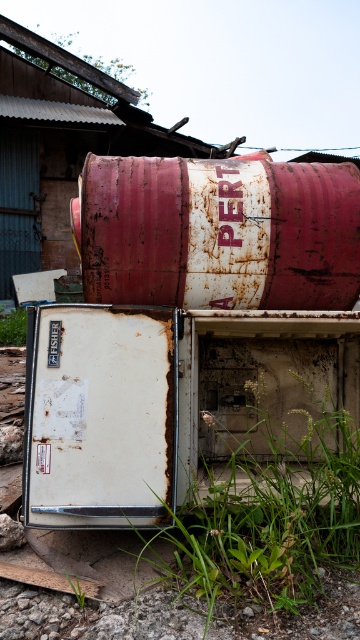
Based on the photo, who is higher up, rusty white refrigerator at lower left or rusty metal barrel at upper center?

rusty metal barrel at upper center is higher up.

Is rusty white refrigerator at lower left bigger than rusty metal barrel at upper center?

Yes.

Locate an element on the screen. rusty white refrigerator at lower left is located at coordinates (168, 401).

Between green grass at lower center and green grass at lower left, which one has more height?

green grass at lower center is taller.

Is green grass at lower center to the left of green grass at lower left from the viewer's perspective?

Incorrect, green grass at lower center is not on the left side of green grass at lower left.

Who is more distant from viewer, (x=192, y=624) or (x=21, y=336)?

The point (x=21, y=336) is behind.

The height and width of the screenshot is (640, 360). In order to click on green grass at lower center in this screenshot , I will do `click(258, 531)`.

Does rusty white refrigerator at lower left appear on the left side of green grass at lower center?

Indeed, rusty white refrigerator at lower left is positioned on the left side of green grass at lower center.

Is rusty white refrigerator at lower left behind green grass at lower center?

Yes, it is behind green grass at lower center.

This screenshot has width=360, height=640. Identify the location of rusty white refrigerator at lower left. click(168, 401).